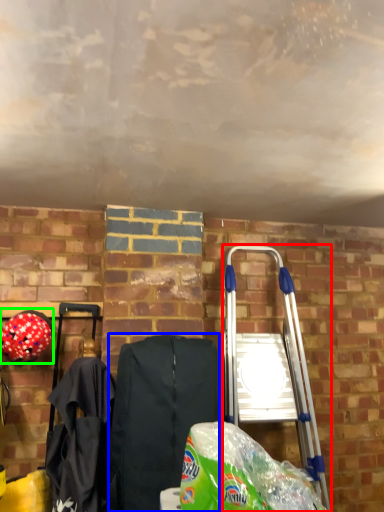
Question: Estimate the real-world distances between objects in this image. Which object is closer to ladder (highlighted by a red box), folding chair (highlighted by a blue box) or helmet (highlighted by a green box)?

Choices:
 (A) folding chair
 (B) helmet

Answer: (A)